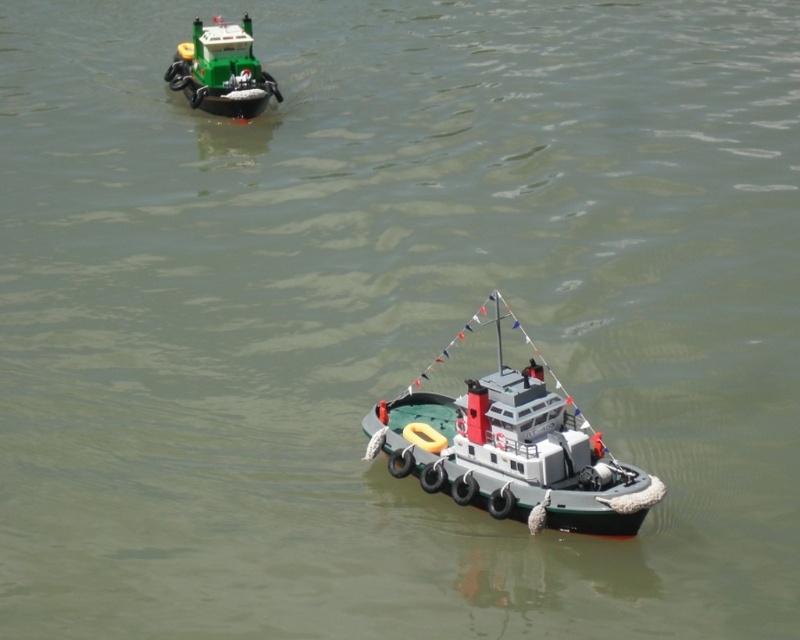
You are standing on a dock and see the gray rubber boat at center. If you want to throw a lifebuoy to someone on the boat, will you need a long throw?

The gray rubber boat at center is 77.23 feet away from camera, so yes, you will need a long throw to reach the gray rubber boat at center.

You are a photographer trying to capture both the gray rubber boat at center and the green plastic tugboat at upper left in a single shot. Given that your camera has a focal length of 50mm and you want to ensure both boats are fully visible without cropping, what should you consider about their distance apart?

The gray rubber boat at center and the green plastic tugboat at upper left are 68.81 feet apart. To capture both in a single shot without cropping, you need to ensure your camera sensor and lens combination can accommodate the distance between them at the 50mm focal length. A wider focal length might be better, but since you are using 50mm, you must position yourself far enough back to frame both boats within the field of view.